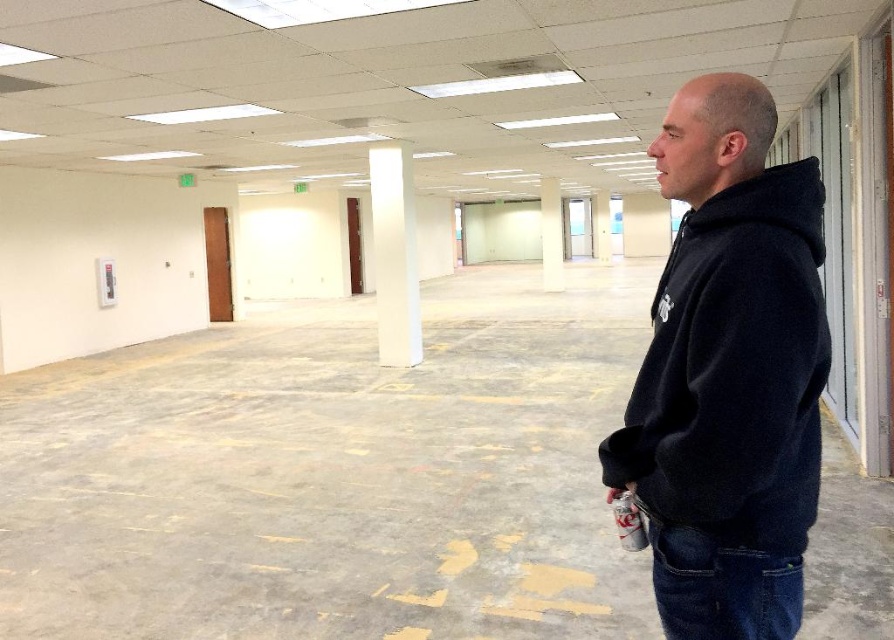
Who is more distant from viewer, [544,220] or [602,204]?

Point [602,204]

Does white smooth pillar at center have a lesser width compared to white concrete pillar at center?

Incorrect, white smooth pillar at center's width is not less than white concrete pillar at center's.

Who is more distant from viewer, (551, 241) or (602, 243)?

The point (602, 243) is more distant.

Where is `white smooth pillar at center`? The width and height of the screenshot is (894, 640). white smooth pillar at center is located at coordinates (551, 234).

Can you confirm if black fleece jacket at right is wider than white glossy column at center?

No, black fleece jacket at right is not wider than white glossy column at center.

I want to click on black fleece jacket at right, so click(730, 372).

Does point (730, 296) come closer to viewer compared to point (394, 365)?

Yes, point (730, 296) is in front of point (394, 365).

You are a GUI agent. You are given a task and a screenshot of the screen. Output one action in this format:
    pyautogui.click(x=<x>, y=<y>)
    Task: Click on the black fleece jacket at right
    This screenshot has width=894, height=640.
    Given the screenshot: What is the action you would take?
    pyautogui.click(x=730, y=372)

Between black fleece jacket at right and white concrete pillar at center, which one has more height?

With more height is white concrete pillar at center.

Is black fleece jacket at right to the left of white concrete pillar at center from the viewer's perspective?

Indeed, black fleece jacket at right is positioned on the left side of white concrete pillar at center.

Does point (628, 476) come farther from viewer compared to point (604, 256)?

That is False.

The height and width of the screenshot is (640, 894). What are the coordinates of `black fleece jacket at right` in the screenshot? It's located at (x=730, y=372).